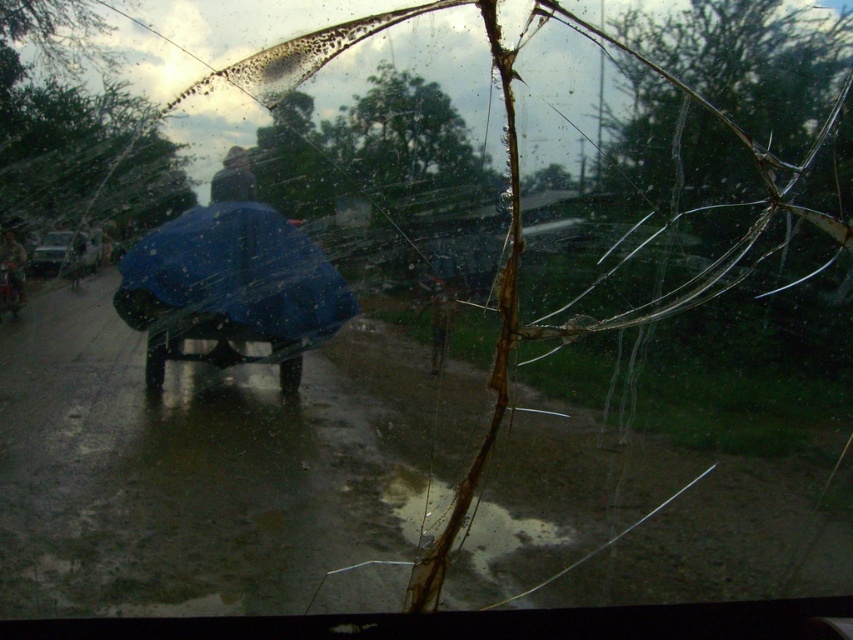
Question: Where is metallic silver car at left located in relation to blue fabric umbrella at left in the image?

Choices:
 (A) above
 (B) below

Answer: (A)

Question: Is metallic silver car at left smaller than blue fabric umbrella at left?

Choices:
 (A) no
 (B) yes

Answer: (A)

Question: Does metallic silver car at left appear over blue fabric umbrella at left?

Choices:
 (A) yes
 (B) no

Answer: (A)

Question: Among these points, which one is farthest from the camera?

Choices:
 (A) (3, 248)
 (B) (36, 252)

Answer: (B)

Question: Which of the following is the farthest from the observer?

Choices:
 (A) (9, 244)
 (B) (38, 269)

Answer: (B)